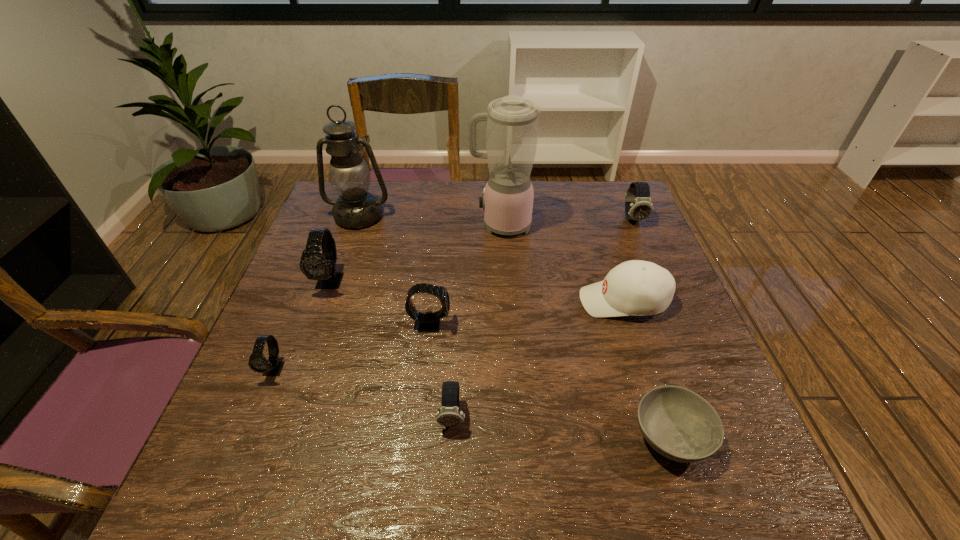
The image size is (960, 540). What are the coordinates of `free space located on the face of the rightmost watch` in the screenshot? It's located at (664, 292).

Locate an element on the screen. free space located on the front-facing side of the baseball cap is located at coordinates [x=514, y=301].

The width and height of the screenshot is (960, 540). I want to click on vacant space located 0.140m on the front-facing side of the baseball cap, so click(x=521, y=301).

At what (x,y) coordinates should I click in order to perform the action: click on vacant space positioned on the front-facing side of the baseball cap. Please return your answer as a coordinate pair (x, y). The width and height of the screenshot is (960, 540). Looking at the image, I should click on (555, 301).

Identify the location of free region located 0.120m on the face of the nearest gray watch. (246, 440).

Identify the location of vacant region located 0.130m on the face of the smaller dark watch. This screenshot has width=960, height=540. (447, 508).

Locate an element on the screen. This screenshot has height=540, width=960. free location located 0.100m on the back of the bowl is located at coordinates click(646, 360).

This screenshot has height=540, width=960. Identify the location of food processor positioned at the far edge. (512, 121).

Identify the location of oil lamp that is positioned at the far edge. (355, 208).

At what (x,y) coordinates should I click in order to perform the action: click on watch that is positioned at the far edge. Please return your answer as a coordinate pair (x, y). Image resolution: width=960 pixels, height=540 pixels. Looking at the image, I should click on (638, 206).